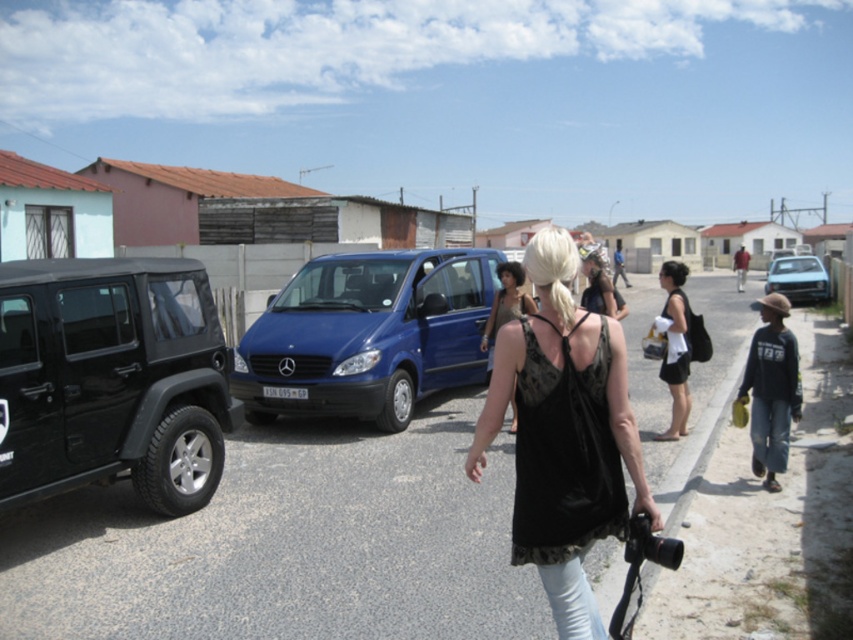
Question: Can you confirm if black lace tank top at center is smaller than blue metallic sedan at right?

Choices:
 (A) no
 (B) yes

Answer: (B)

Question: Estimate the real-world distances between objects in this image. Which object is closer to the blue metallic sedan at right?

Choices:
 (A) black fabric dress at center
 (B) blue metallic van at center
 (C) shiny black jeep at left

Answer: (A)

Question: Which object appears closest to the camera in this image?

Choices:
 (A) black fabric dress at center
 (B) blue metallic van at center
 (C) shiny black jeep at left
 (D) matte black dress at center

Answer: (C)

Question: Considering the relative positions of black fabric dress at center and blue metallic sedan at right in the image provided, where is black fabric dress at center located with respect to blue metallic sedan at right?

Choices:
 (A) above
 (B) below

Answer: (A)

Question: Is black fabric dress at center smaller than blue metallic sedan at right?

Choices:
 (A) no
 (B) yes

Answer: (A)

Question: Which of the following is the closest to the observer?

Choices:
 (A) (61, 326)
 (B) (671, 307)
 (C) (505, 266)
 (D) (805, 256)

Answer: (A)